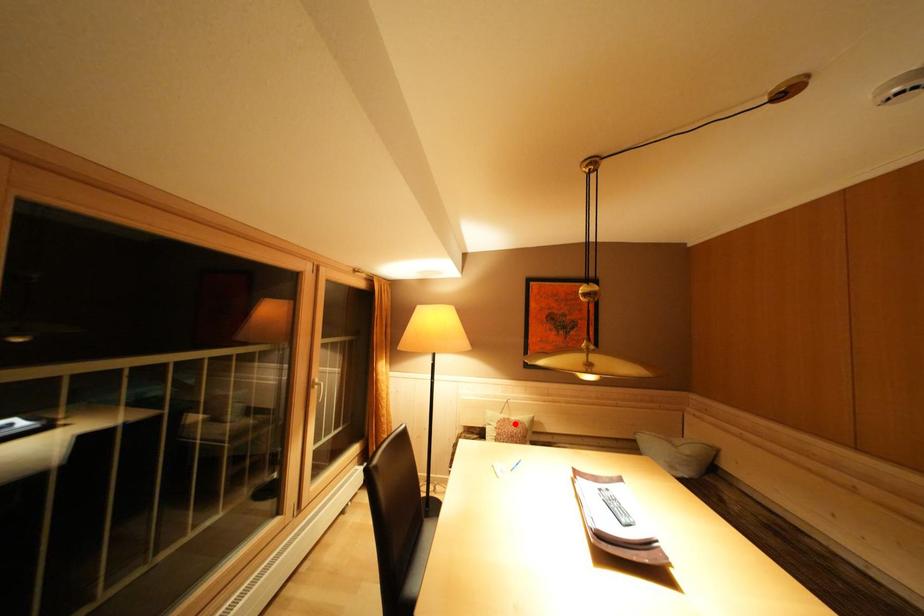
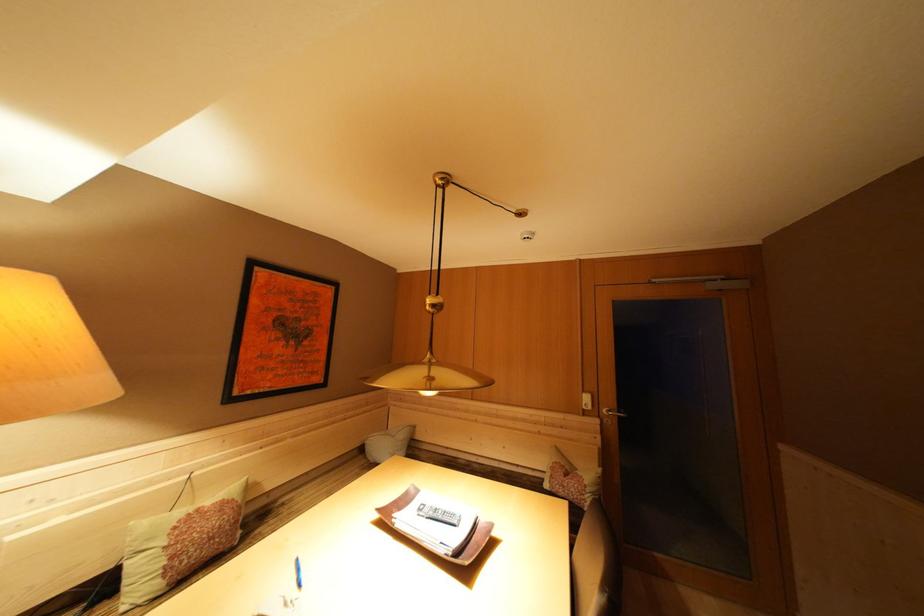
Locate, in the second image, the point that corresponds to the highlighted location in the first image.

(204, 515)